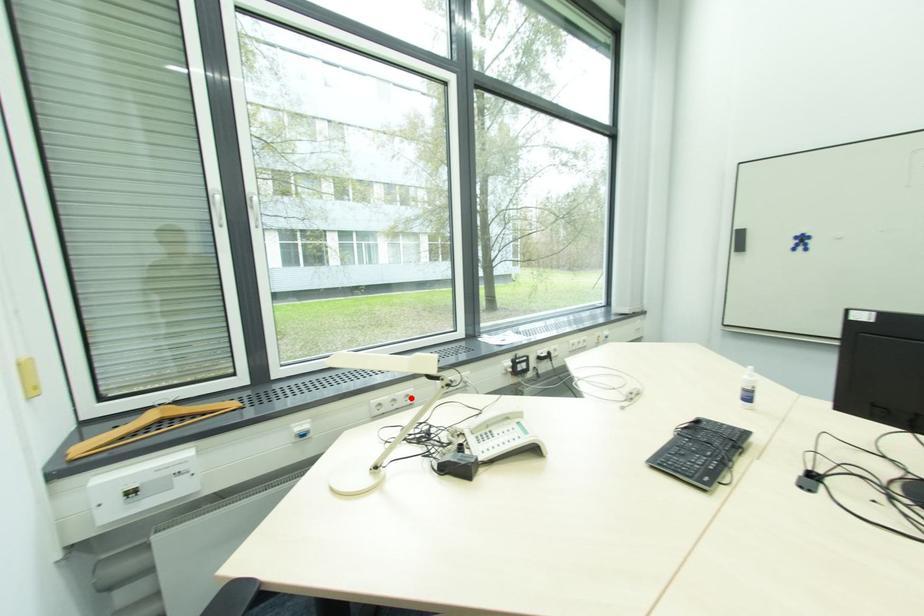
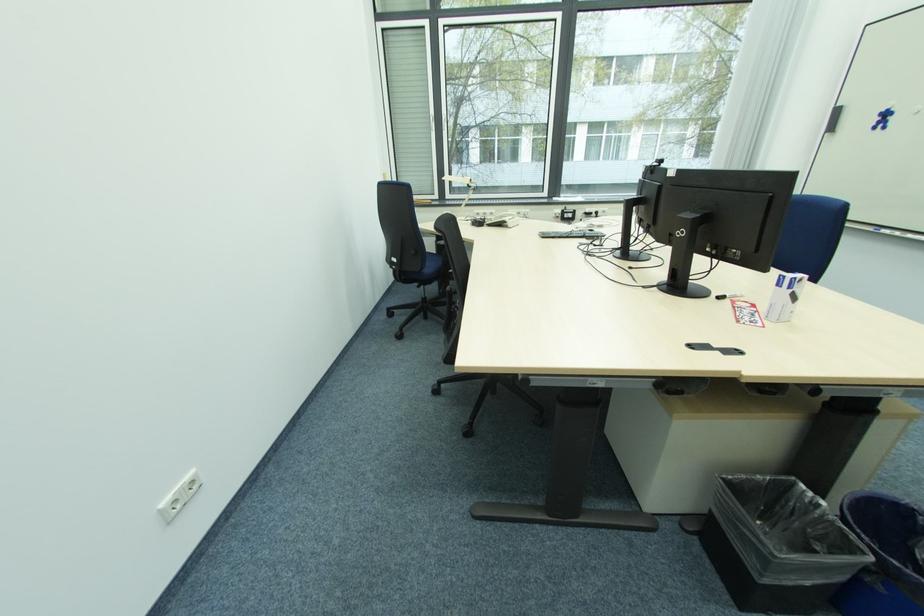
Find the pixel in the second image that matches the highlighted location in the first image.

(494, 216)